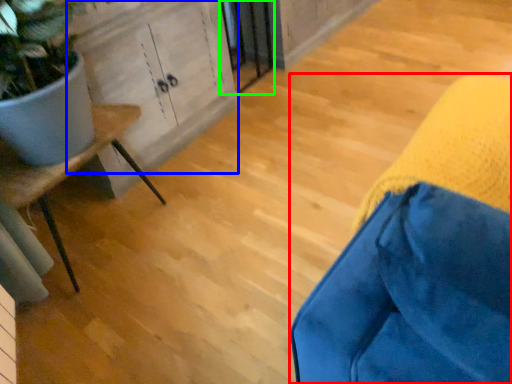
Question: Estimate the real-world distances between objects in this image. Which object is closer to furniture (highlighted by a red box), cabinetry (highlighted by a blue box) or screen door (highlighted by a green box)?

Choices:
 (A) cabinetry
 (B) screen door

Answer: (A)